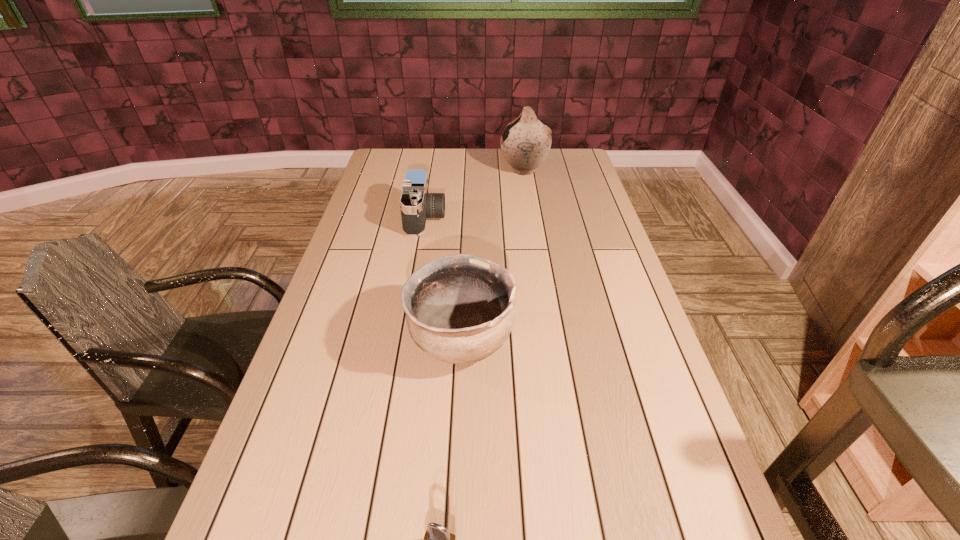
Locate an element on the screen. vacant space located on the front-facing side of the third tallest object is located at coordinates (529, 218).

This screenshot has height=540, width=960. Find the location of `object that is positioned at the far edge`. object that is positioned at the far edge is located at coordinates (525, 143).

Where is `object situated at the right edge`? Image resolution: width=960 pixels, height=540 pixels. object situated at the right edge is located at coordinates (525, 143).

At what (x,y) coordinates should I click in order to perform the action: click on object at the far right corner. Please return your answer as a coordinate pair (x, y). This screenshot has width=960, height=540. Looking at the image, I should click on (525, 143).

Find the location of a particular element. free region at the far edge of the desktop is located at coordinates (456, 168).

In the image, there is a desktop. At what (x,y) coordinates should I click in order to perform the action: click on vacant space at the left edge. Please return your answer as a coordinate pair (x, y). This screenshot has width=960, height=540. Looking at the image, I should click on (387, 228).

Locate an element on the screen. Image resolution: width=960 pixels, height=540 pixels. vacant space at the right edge of the desktop is located at coordinates (644, 322).

Locate an element on the screen. blank area at the far left corner is located at coordinates (390, 159).

In order to click on empty space that is in between the farthest object and the camera in this screenshot , I will do `click(475, 194)`.

At what (x,y) coordinates should I click in order to perform the action: click on free spot between the farthest object and the second nearest object. Please return your answer as a coordinate pair (x, y). Image resolution: width=960 pixels, height=540 pixels. Looking at the image, I should click on (492, 255).